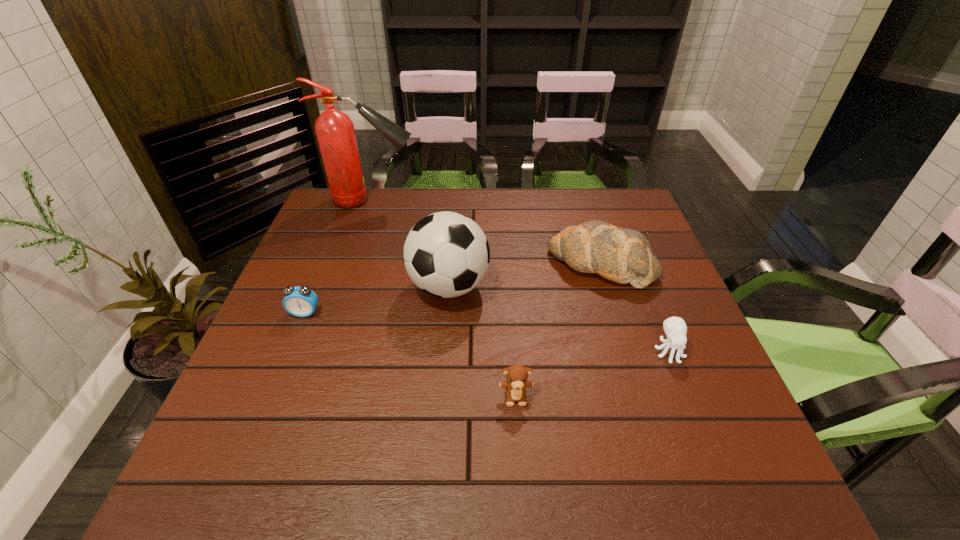
Image resolution: width=960 pixels, height=540 pixels. I want to click on object situated at the far left corner, so click(x=335, y=133).

You are a GUI agent. You are given a task and a screenshot of the screen. Output one action in this format:
    pyautogui.click(x=<x>, y=<y>)
    Task: Click on the vacant space at the far edge
    The image size is (960, 540).
    Given the screenshot: What is the action you would take?
    pyautogui.click(x=566, y=214)

Identify the location of blank space at the near edge. The image size is (960, 540). (641, 489).

What are the coordinates of `blank space at the left edge` in the screenshot? It's located at (302, 258).

This screenshot has height=540, width=960. I want to click on free space at the right edge, so click(x=711, y=377).

I want to click on vacant area at the far right corner of the desktop, so click(615, 214).

I want to click on unoccupied area between the fourth shortest object and the tallest object, so click(487, 232).

The height and width of the screenshot is (540, 960). In order to click on free space between the bread and the tallest object in this screenshot , I will do `click(487, 232)`.

At what (x,y) coordinates should I click in order to perform the action: click on vacant space that's between the nearest object and the alarm clock. Please return your answer as a coordinate pair (x, y). This screenshot has height=540, width=960. Looking at the image, I should click on (410, 354).

I want to click on vacant point located between the farthest object and the alarm clock, so click(x=338, y=256).